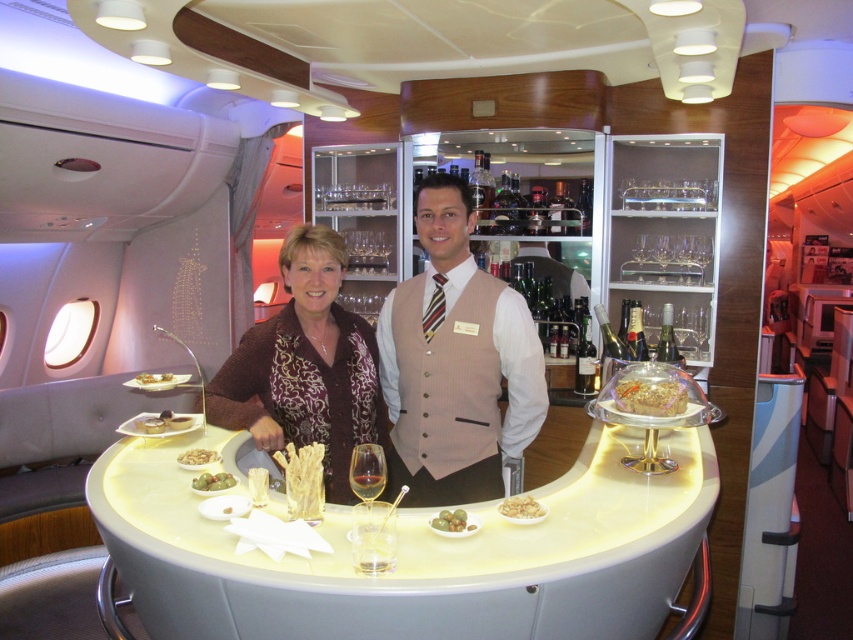
You are a flight attendant on the private jet and need to place a new dessert plate on the bar counter. The dessert plate is the same size as the translucent glass dish at center. Will it fit next to the translucent glass wine glass at center without overlapping?

The translucent glass dish at center is wider than the translucent glass wine glass at center, so the dessert plate, being the same size as the dish, will not fit next to the wine glass without overlapping since it is wider.

You are a flight attendant on a private jet and need to place a dessert plate between the translucent glass wine glass at center and the matte gold plate at center. The dessert plate has a diameter of 12 inches. Can you fit it between them without moving the existing items?

The distance between the translucent glass wine glass at center and the matte gold plate at center is 35.20 inches. Since the dessert plate has a diameter of only 12 inches, there is more than enough space to place it between them without disturbing the existing items.